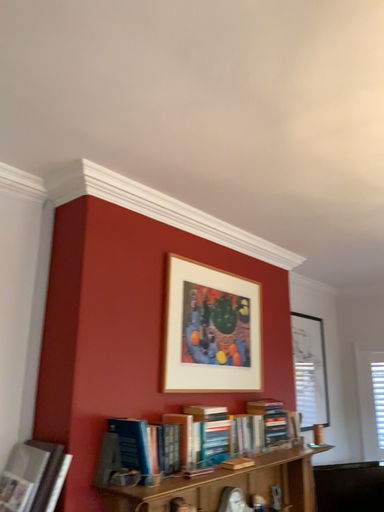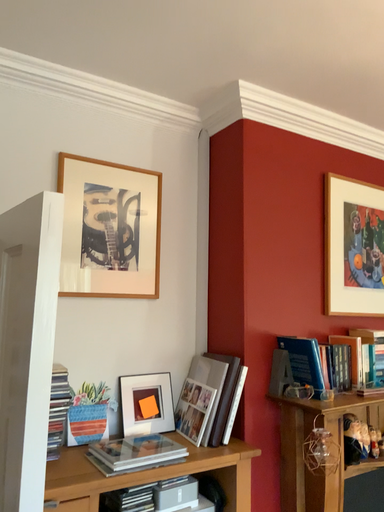
Question: Which way did the camera rotate in the video?

Choices:
 (A) rotated left
 (B) rotated right

Answer: (A)